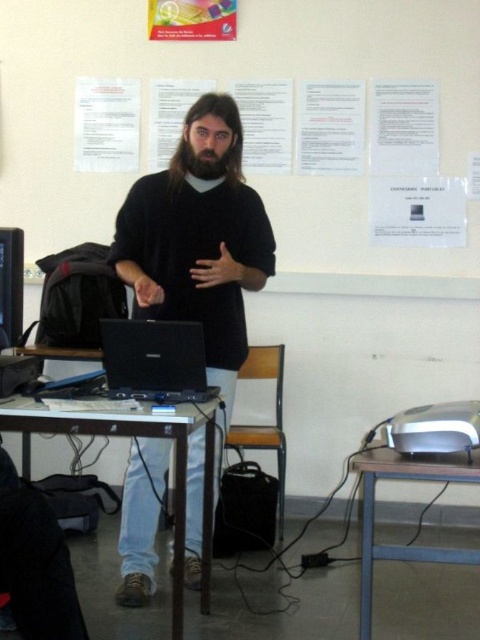
Question: Does black matte laptop at center have a smaller size compared to dark brown fuzzy beard at center?

Choices:
 (A) yes
 (B) no

Answer: (B)

Question: Where is wooden table at center located in relation to black matte hand at center in the image?

Choices:
 (A) below
 (B) above

Answer: (A)

Question: Which point is farther from the camera taking this photo?

Choices:
 (A) tap(144, 296)
 (B) tap(4, 296)
 (C) tap(239, 268)

Answer: (C)

Question: Among these objects, which one is nearest to the camera?

Choices:
 (A) black matte laptop at center
 (B) black matte hand at center
 (C) pinkish skin hand at center
 (D) black glossy laptop at left

Answer: (A)

Question: Which point appears farthest from the camera in this image?

Choices:
 (A) (149, 289)
 (B) (143, 321)
 (C) (202, 164)
 (D) (175, 598)

Answer: (C)

Question: Is black matte laptop at center above metallic silver table at lower right?

Choices:
 (A) yes
 (B) no

Answer: (A)